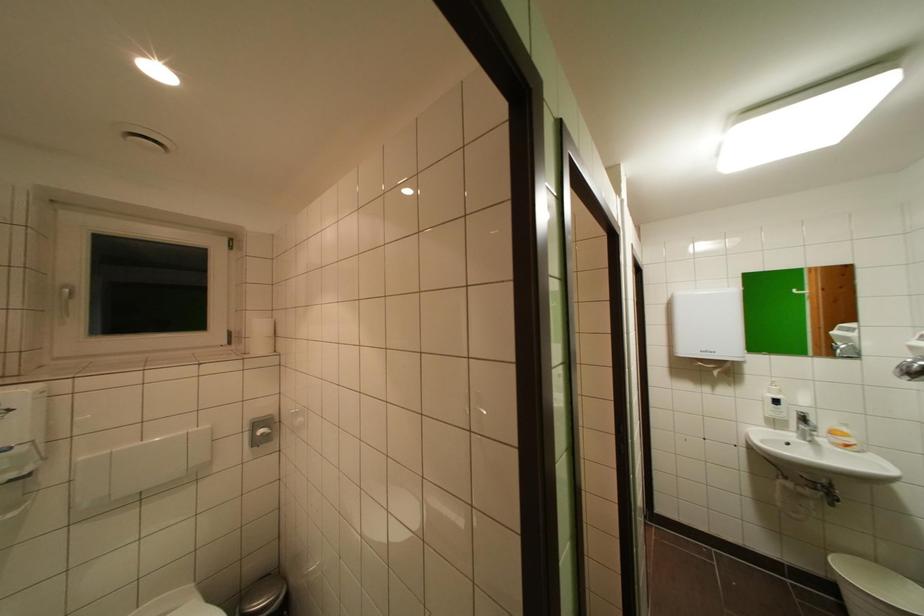
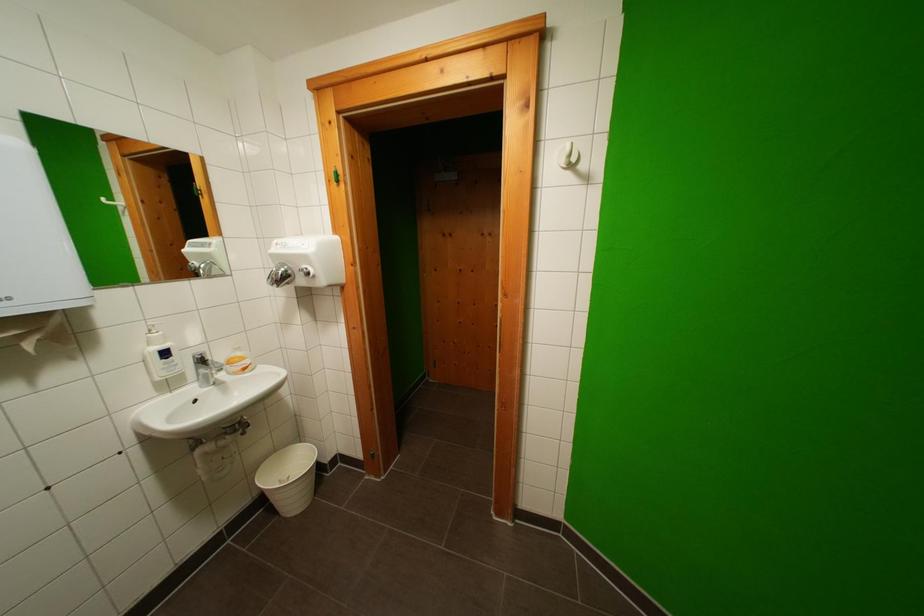
Question: Based on the continuous images, in which direction is the camera rotating? Reply with the corresponding letter.

Choices:
 (A) Left
 (B) Right
 (C) Up
 (D) Down

Answer: (B)